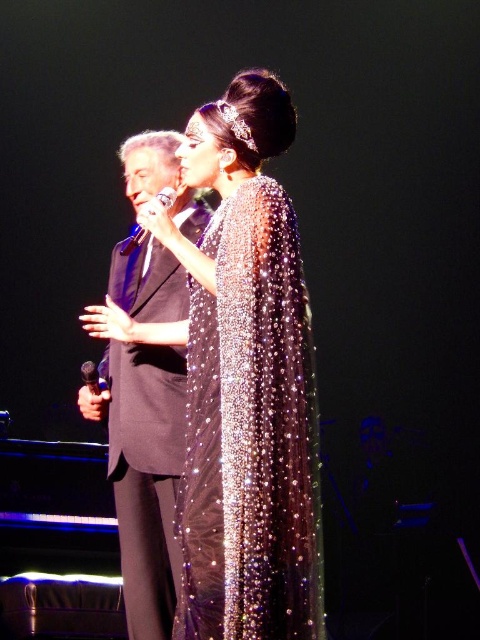
Which is more to the left, black satin suit at center or metallic silver microphone at upper center?

black satin suit at center

Is black satin suit at center positioned at the back of metallic silver microphone at upper center?

Yes, it is behind metallic silver microphone at upper center.

Does point (131, 628) lie in front of point (136, 232)?

Yes, it is in front of point (136, 232).

Image resolution: width=480 pixels, height=640 pixels. Find the location of `black satin suit at center`. black satin suit at center is located at coordinates (144, 472).

Does sparkly sequined dress at center appear under metallic silver microphone at center?

Indeed, sparkly sequined dress at center is positioned under metallic silver microphone at center.

Is point (279, 317) farther from viewer compared to point (103, 378)?

No, (279, 317) is in front of (103, 378).

Find the location of `sparkly sequined dress at center`. sparkly sequined dress at center is located at coordinates (x=251, y=435).

In the scene shown: Between metallic silver microphone at upper center and metallic silver microphone at center, which one appears on the right side from the viewer's perspective?

metallic silver microphone at upper center

Can you confirm if metallic silver microphone at upper center is positioned to the left of metallic silver microphone at center?

Incorrect, metallic silver microphone at upper center is not on the left side of metallic silver microphone at center.

Is point (156, 196) behind point (103, 378)?

No, (156, 196) is in front of (103, 378).

Find the location of a particular element. The height and width of the screenshot is (640, 480). metallic silver microphone at upper center is located at coordinates (132, 241).